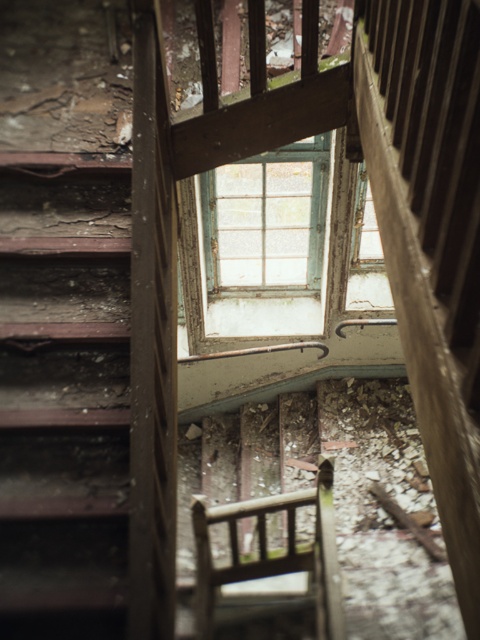
Question: Considering the relative positions of rusty metal stairs at left and green weathered wood window at center in the image provided, where is rusty metal stairs at left located with respect to green weathered wood window at center?

Choices:
 (A) above
 (B) below

Answer: (B)

Question: Which of the following is the closest to the observer?

Choices:
 (A) green weathered wood window at center
 (B) rusty metal stairs at left

Answer: (B)

Question: Which point is closer to the camera taking this photo?

Choices:
 (A) (314, 488)
 (B) (223, 248)

Answer: (A)

Question: Can you confirm if rusty metal stairs at left is positioned to the right of wooden chair at center?

Choices:
 (A) yes
 (B) no

Answer: (B)

Question: Among these points, which one is nearest to the camera?

Choices:
 (A) (275, 179)
 (B) (48, 525)

Answer: (B)

Question: Is green weathered wood window at center to the right of wooden chair at center from the viewer's perspective?

Choices:
 (A) yes
 (B) no

Answer: (B)